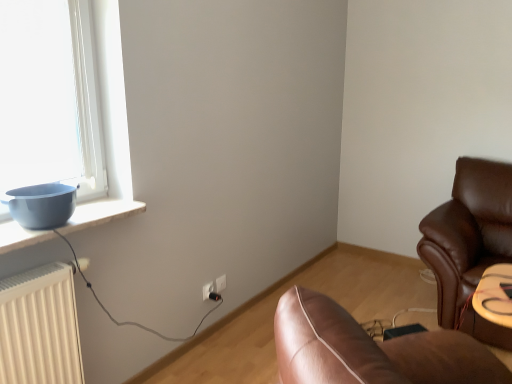
Measure the distance between point (216, 279) and camera.

The depth of point (216, 279) is 8.15 feet.

In order to face white plastic electric outlet at lower center, placed as the first electric outlet when sorted from back to front, should I rotate leftwards or rightwards?

Turn left approximately 4.939 degrees to face it.

What do you see at coordinates (41, 205) in the screenshot? This screenshot has width=512, height=384. I see `matte blue bowl at left` at bounding box center [41, 205].

Locate an element on the screen. The width and height of the screenshot is (512, 384). white plastic electric outlet at center, which is the first electric outlet in front-to-back order is located at coordinates (208, 290).

Considering the relative sizes of black plastic plug at lower center and white plastic electric outlet at center, which is the first electric outlet in front-to-back order, in the image provided, is black plastic plug at lower center thinner than white plastic electric outlet at center, which is the first electric outlet in front-to-back order,?

No, black plastic plug at lower center is not thinner than white plastic electric outlet at center, which is the first electric outlet in front-to-back order.

How different are the orientations of black plastic plug at lower center and white plastic electric outlet at center, marked as the second electric outlet in a back-to-front arrangement, in degrees?

The facing directions of black plastic plug at lower center and white plastic electric outlet at center, marked as the second electric outlet in a back-to-front arrangement, are 6.99 degrees apart.

How far apart are black plastic plug at lower center and white plastic electric outlet at center, the 2th electric outlet when ordered from right to left?

The distance of black plastic plug at lower center from white plastic electric outlet at center, the 2th electric outlet when ordered from right to left, is 1.86 inches.

Can you confirm if black plastic plug at lower center is shorter than white plastic electric outlet at center, the first electric outlet in the left-to-right sequence?

Correct, black plastic plug at lower center is not as tall as white plastic electric outlet at center, the first electric outlet in the left-to-right sequence.

Can you tell me how much white plastic electric outlet at lower center, which is the second electric outlet from left to right, and black plastic plug at lower center differ in facing direction?

There is a 2.86-degree angle between the facing directions of white plastic electric outlet at lower center, which is the second electric outlet from left to right, and black plastic plug at lower center.

Is white plastic electric outlet at lower center, the first electric outlet from the right, located outside black plastic plug at lower center?

That's correct, white plastic electric outlet at lower center, the first electric outlet from the right, is outside of black plastic plug at lower center.

Considering the relative positions of white plastic electric outlet at lower center, placed as the first electric outlet when sorted from back to front, and black plastic plug at lower center in the image provided, is white plastic electric outlet at lower center, placed as the first electric outlet when sorted from back to front, to the left of black plastic plug at lower center from the viewer's perspective?

No, white plastic electric outlet at lower center, placed as the first electric outlet when sorted from back to front, is not to the left of black plastic plug at lower center.

Based on the photo, is matte blue bowl at left oriented away from white plastic electric outlet at lower center, which is the second electric outlet in front-to-back order?

No, matte blue bowl at left is not facing the opposite direction of white plastic electric outlet at lower center, which is the second electric outlet in front-to-back order.

From the picture: From the image's perspective, which object appears higher, matte blue bowl at left or white plastic electric outlet at lower center, the first electric outlet from the right?

matte blue bowl at left appears higher in the image.

Considering the sizes of objects matte blue bowl at left and white plastic electric outlet at lower center, the first electric outlet from the right, in the image provided, who is taller, matte blue bowl at left or white plastic electric outlet at lower center, the first electric outlet from the right,?

Standing taller between the two is matte blue bowl at left.

Which of these two, matte blue bowl at left or white plastic electric outlet at lower center, which is the second electric outlet from left to right, is smaller?

white plastic electric outlet at lower center, which is the second electric outlet from left to right, is smaller.

Which object is further away from the camera, white plastic electric outlet at center, the first electric outlet in the left-to-right sequence, or matte blue bowl at left?

white plastic electric outlet at center, the first electric outlet in the left-to-right sequence, is further from the camera.

Is matte blue bowl at left a part of white plastic electric outlet at center, which is the first electric outlet in front-to-back order?

No, matte blue bowl at left is not a part of white plastic electric outlet at center, which is the first electric outlet in front-to-back order.

From the matte blue bowl at left, count 1st electric outlet to the right and point to it. Please provide its 2D coordinates.

[(208, 290)]

Would you say white plastic electric outlet at center, marked as the second electric outlet in a back-to-front arrangement, is to the left or to the right of matte blue bowl at left in the picture?

white plastic electric outlet at center, marked as the second electric outlet in a back-to-front arrangement, is to the right of matte blue bowl at left.

From the image's perspective, is white plastic electric outlet at lower center, placed as the first electric outlet when sorted from back to front, located above matte blue bowl at left?

Actually, white plastic electric outlet at lower center, placed as the first electric outlet when sorted from back to front, appears below matte blue bowl at left in the image.

Can you confirm if white plastic electric outlet at lower center, the first electric outlet from the right, is taller than matte blue bowl at left?

No, white plastic electric outlet at lower center, the first electric outlet from the right, is not taller than matte blue bowl at left.

Looking at this image, in the image, is white plastic electric outlet at lower center, which is the second electric outlet from left to right, positioned in front of or behind matte blue bowl at left?

Visually, white plastic electric outlet at lower center, which is the second electric outlet from left to right, is located behind matte blue bowl at left.

From a real-world perspective, is white plastic electric outlet at lower center, placed as the first electric outlet when sorted from back to front, located beneath matte blue bowl at left?

Yes, from a real-world perspective, white plastic electric outlet at lower center, placed as the first electric outlet when sorted from back to front, is below matte blue bowl at left.

Would you say white plastic electric outlet at lower center, placed as the first electric outlet when sorted from back to front, is to the left or to the right of white plastic electric outlet at center, marked as the second electric outlet in a back-to-front arrangement, in the picture?

From the image, it's evident that white plastic electric outlet at lower center, placed as the first electric outlet when sorted from back to front, is to the right of white plastic electric outlet at center, marked as the second electric outlet in a back-to-front arrangement.

Image resolution: width=512 pixels, height=384 pixels. What are the coordinates of `electric outlet that appears below the white plastic electric outlet at lower center, which is the second electric outlet from left to right (from the image's perspective)` in the screenshot? It's located at (208, 290).

Looking at their sizes, would you say white plastic electric outlet at lower center, the first electric outlet from the right, is wider or thinner than white plastic electric outlet at center, marked as the second electric outlet in a back-to-front arrangement?

Clearly, white plastic electric outlet at lower center, the first electric outlet from the right, has less width compared to white plastic electric outlet at center, marked as the second electric outlet in a back-to-front arrangement.

From the picture: From the image's perspective, which is above, black plastic plug at lower center or matte blue bowl at left?

matte blue bowl at left appears higher in the image.

Is black plastic plug at lower center positioned in front of matte blue bowl at left?

That is False.

Find the location of a particular element. The width and height of the screenshot is (512, 384). bowl lying in front of the black plastic plug at lower center is located at coordinates (41, 205).

Can you tell me how much black plastic plug at lower center and matte blue bowl at left differ in facing direction?

The angle between the facing direction of black plastic plug at lower center and the facing direction of matte blue bowl at left is 2.34 degrees.

This screenshot has height=384, width=512. Identify the location of electric outlet that is the 1st one above the black plastic plug at lower center (from a real-world perspective). (208, 290).

The image size is (512, 384). Identify the location of plug in front of the white plastic electric outlet at lower center, which is the second electric outlet in front-to-back order. [215, 296].

Considering their positions, is white plastic electric outlet at center, marked as the second electric outlet in a back-to-front arrangement, positioned closer to black plastic plug at lower center than white plastic electric outlet at lower center, placed as the first electric outlet when sorted from back to front?

white plastic electric outlet at center, marked as the second electric outlet in a back-to-front arrangement, lies closer to black plastic plug at lower center than the other object.

Looking at the image, which one is located further to black plastic plug at lower center, matte blue bowl at left or white plastic electric outlet at lower center, which is the second electric outlet in front-to-back order?

matte blue bowl at left is positioned further to the anchor black plastic plug at lower center.

From the image, which object appears to be farther from white plastic electric outlet at center, marked as the second electric outlet in a back-to-front arrangement, black plastic plug at lower center or white plastic electric outlet at lower center, which is the second electric outlet from left to right?

The object further to white plastic electric outlet at center, marked as the second electric outlet in a back-to-front arrangement, is white plastic electric outlet at lower center, which is the second electric outlet from left to right.

Considering their positions, is black plastic plug at lower center positioned further to matte blue bowl at left than white plastic electric outlet at lower center, placed as the first electric outlet when sorted from back to front?

Among the two, white plastic electric outlet at lower center, placed as the first electric outlet when sorted from back to front, is located further to matte blue bowl at left.

From the image, which object appears to be nearer to white plastic electric outlet at lower center, which is the second electric outlet from left to right, matte blue bowl at left or white plastic electric outlet at center, the 2th electric outlet when ordered from right to left?

Among the two, white plastic electric outlet at center, the 2th electric outlet when ordered from right to left, is located nearer to white plastic electric outlet at lower center, which is the second electric outlet from left to right.

From the image, which object appears to be farther from black plastic plug at lower center, white plastic electric outlet at center, the first electric outlet in the left-to-right sequence, or matte blue bowl at left?

The object further to black plastic plug at lower center is matte blue bowl at left.

Based on their spatial positions, is black plastic plug at lower center or matte blue bowl at left closer to white plastic electric outlet at lower center, placed as the first electric outlet when sorted from back to front?

The object closer to white plastic electric outlet at lower center, placed as the first electric outlet when sorted from back to front, is black plastic plug at lower center.

Considering their positions, is black plastic plug at lower center positioned further to white plastic electric outlet at lower center, placed as the first electric outlet when sorted from back to front, than white plastic electric outlet at center, the first electric outlet in the left-to-right sequence?

white plastic electric outlet at center, the first electric outlet in the left-to-right sequence.

The image size is (512, 384). Identify the location of plug between matte blue bowl at left and white plastic electric outlet at lower center, the first electric outlet from the right, from front to back. (215, 296).

The image size is (512, 384). I want to click on electric outlet located between matte blue bowl at left and white plastic electric outlet at lower center, which is the second electric outlet in front-to-back order, in the depth direction, so click(208, 290).

Find the location of a particular element. The width and height of the screenshot is (512, 384). electric outlet located between matte blue bowl at left and black plastic plug at lower center in the depth direction is located at coordinates (208, 290).

This screenshot has height=384, width=512. I want to click on plug between white plastic electric outlet at center, which is the first electric outlet in front-to-back order, and white plastic electric outlet at lower center, which is the second electric outlet in front-to-back order, along the z-axis, so point(215,296).